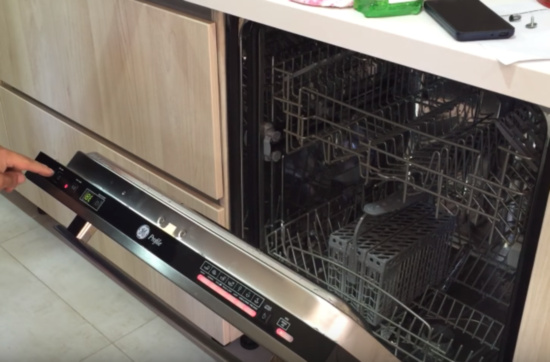
Locate an element on the screen. This screenshot has height=362, width=550. left inside wall of dishwasher is located at coordinates (308, 172).